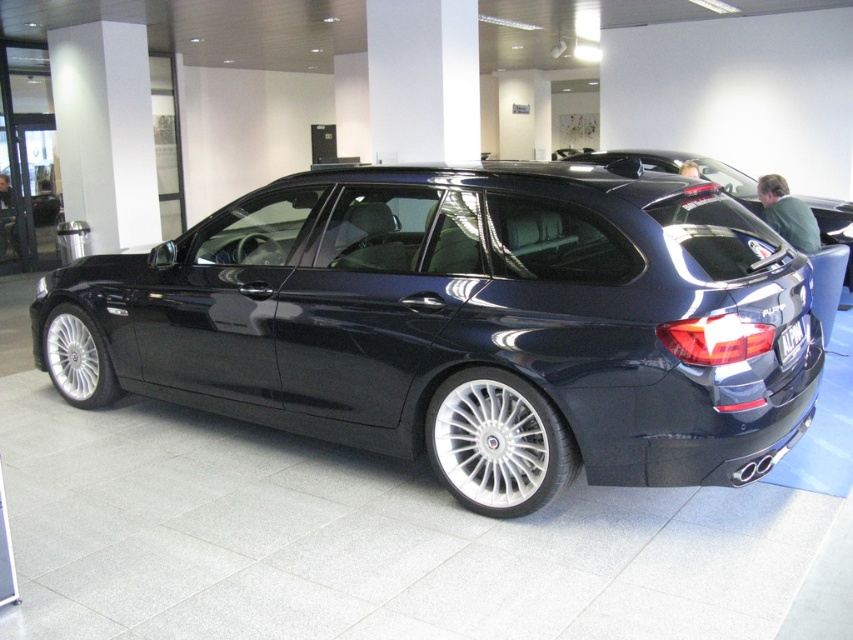
Between glossy dark blue wagon at center and glossy black car at center, which one has less height?

glossy dark blue wagon at center

Does glossy dark blue wagon at center have a greater width compared to glossy black car at center?

Yes.

Does point (345, 394) come behind point (817, 218)?

No, (345, 394) is closer to viewer.

Where is `glossy dark blue wagon at center`? This screenshot has height=640, width=853. glossy dark blue wagon at center is located at coordinates (463, 324).

Is glossy dark blue wagon at center behind black plastic license plate at rear?

No, it is not.

Which is in front, point (236, 368) or point (792, 349)?

Point (792, 349)

The width and height of the screenshot is (853, 640). I want to click on glossy dark blue wagon at center, so click(x=463, y=324).

Where is `glossy dark blue wagon at center`? The height and width of the screenshot is (640, 853). glossy dark blue wagon at center is located at coordinates (463, 324).

Consider the image. Is glossy black car at center above black plastic license plate at rear?

Yes.

Does glossy black car at center have a greater width compared to black plastic license plate at rear?

Yes.

Is point (849, 209) positioned after point (793, 323)?

Yes, it is.

At what (x,y) coordinates should I click in order to perform the action: click on glossy black car at center. Please return your answer as a coordinate pair (x, y). This screenshot has height=640, width=853. Looking at the image, I should click on (677, 170).